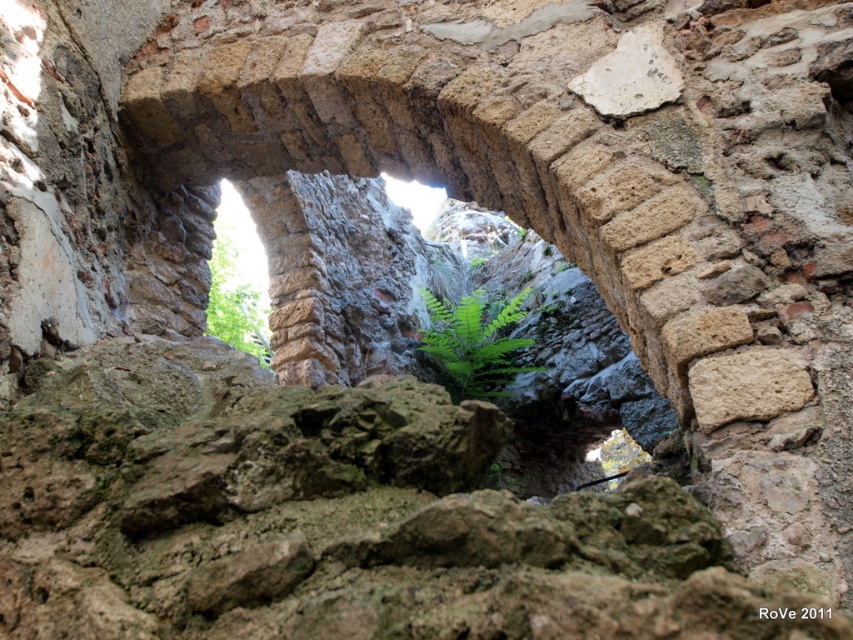
You are standing in front of an ancient structure and want to take a photo of the natural stone archway at center. According to the coordinates provided, where exactly should you aim your camera to capture the archway perfectly?

You should aim your camera at point coordinates (450, 300) to capture the natural stone archway at center perfectly.

You are standing in front of an ancient stone archway. You see two plants inside the archway scene. The first is a green leafy fern at center, and the second is a green leafy plant at upper left. From your perspective, which plant is positioned to the right of the other?

The green leafy fern at center is positioned to the right of the green leafy plant at upper left.